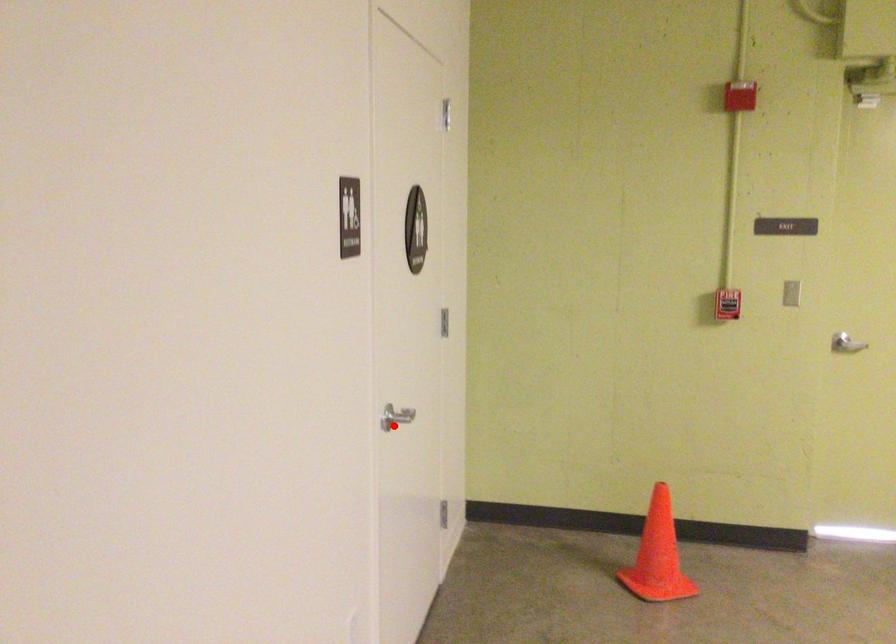
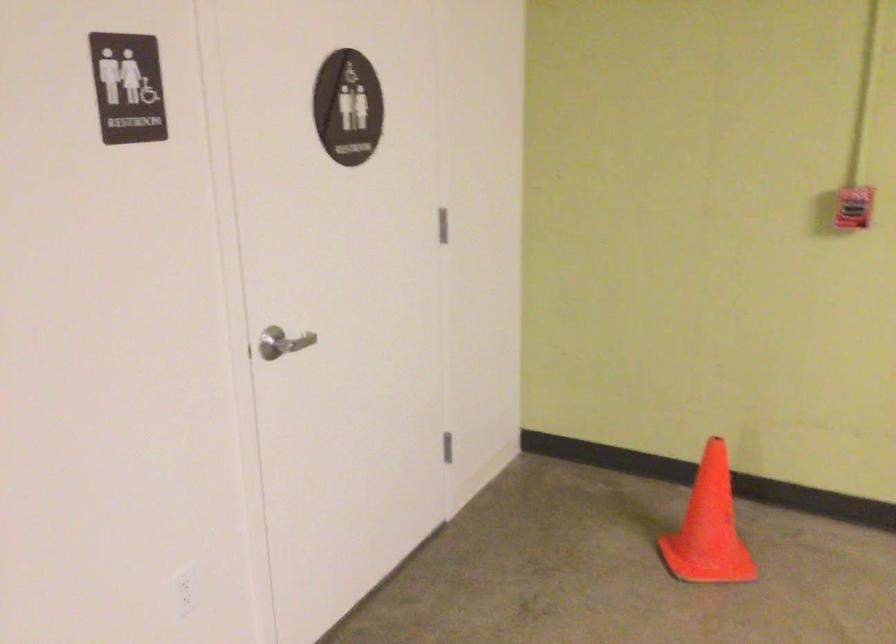
Question: A red point is marked in image1. In image2, is the corresponding 3D point closer to the camera or farther? Reply with the corresponding letter.

Choices:
 (A) The corresponding 3D point is closer.
 (B) The corresponding 3D point is farther.

Answer: (A)